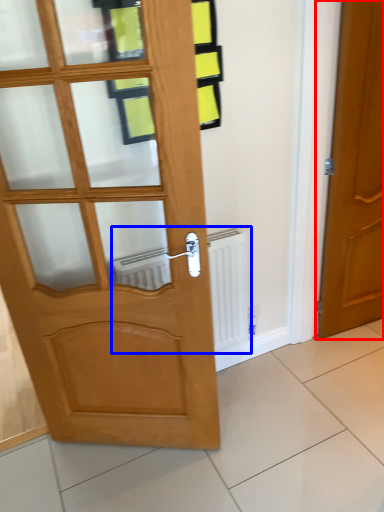
Question: Among these objects, which one is nearest to the camera, door (highlighted by a red box) or radiator (highlighted by a blue box)?

Choices:
 (A) door
 (B) radiator

Answer: (A)